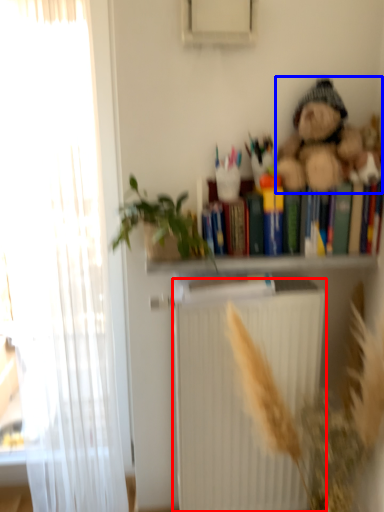
Question: Which object appears farthest to the camera in this image, radiator (highlighted by a red box) or teddy bear (highlighted by a blue box)?

Choices:
 (A) radiator
 (B) teddy bear

Answer: (A)